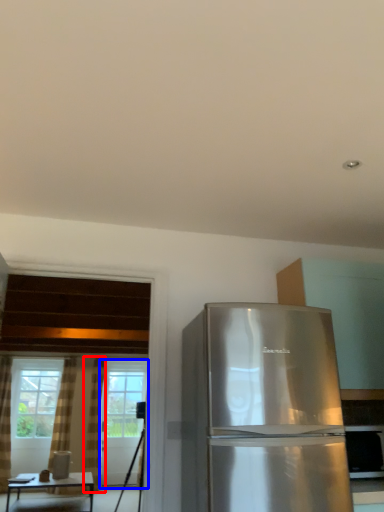
Question: Which point is closer to the camera, curtain (highlighted by a red box) or screen door (highlighted by a blue box)?

Choices:
 (A) curtain
 (B) screen door

Answer: (A)